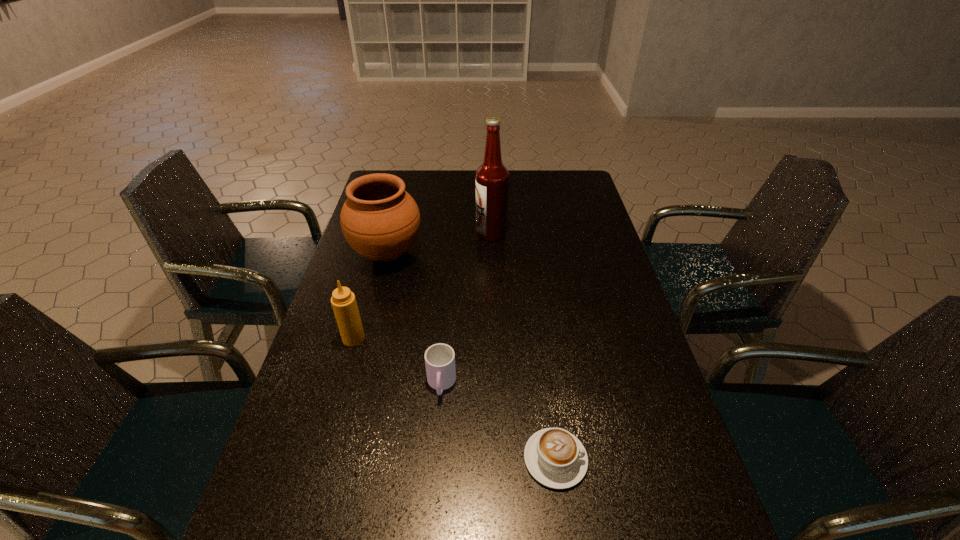
Identify the location of vacant region located on the label side of the tallest object. (379, 233).

Locate an element on the screen. This screenshot has height=540, width=960. vacant area situated on the label side of the tallest object is located at coordinates (459, 233).

In order to click on free spot located on the right of the second tallest object in this screenshot , I will do `click(523, 254)`.

Find the location of a particular element. vacant point located 0.280m on the front of the third tallest object is located at coordinates (323, 447).

The image size is (960, 540). I want to click on vacant area situated with the handle on the side of the cup, so click(429, 534).

Identify the location of vacant region located with the handle on the right side of the cappuccino. click(625, 459).

Locate an element on the screen. pottery that is at the left edge is located at coordinates coord(381,221).

Find the location of `condiment that is at the left edge`. condiment that is at the left edge is located at coordinates (343, 301).

At what (x,y) coordinates should I click in order to perform the action: click on free location at the far edge of the desktop. Please return your answer as a coordinate pair (x, y). The image size is (960, 540). Looking at the image, I should click on (534, 190).

Find the location of `vacant space at the left edge of the desktop`. vacant space at the left edge of the desktop is located at coordinates (390, 281).